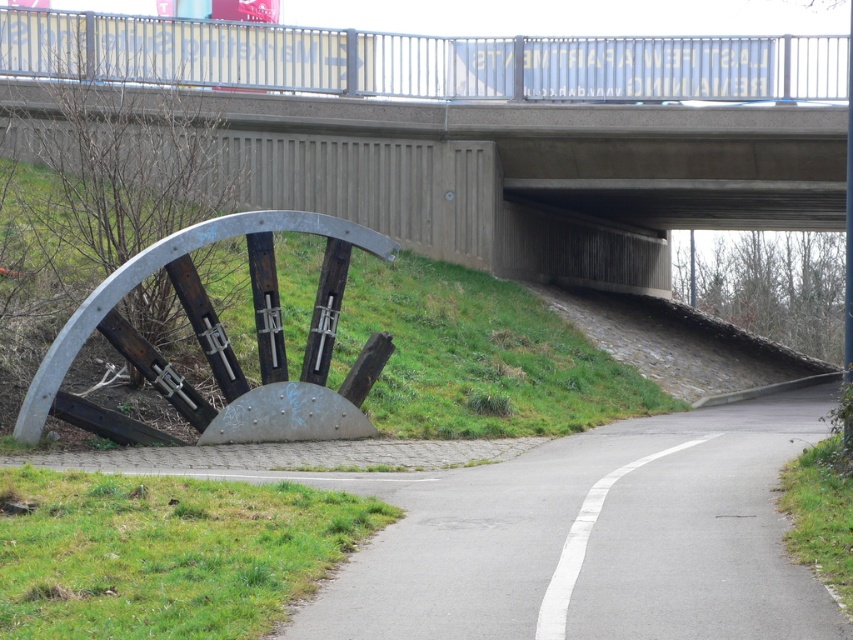
Can you confirm if concrete bridge at upper center is smaller than gray asphalt road at lower center?

Incorrect, concrete bridge at upper center is not smaller in size than gray asphalt road at lower center.

Does point (315, 173) come behind point (413, 525)?

Yes.

Identify the location of concrete bridge at upper center. The width and height of the screenshot is (853, 640). (495, 128).